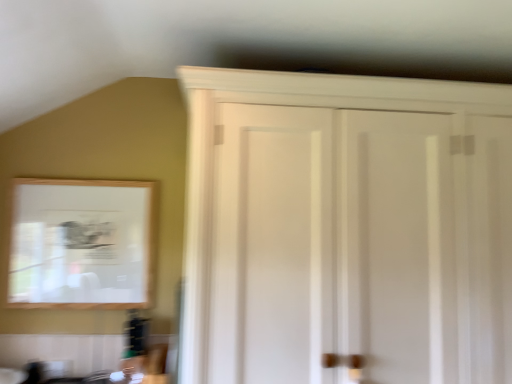
Question: Is wooden-framed mirror at upper left closer to camera compared to white wood cupboard at upper right?

Choices:
 (A) yes
 (B) no

Answer: (B)

Question: Does wooden-framed mirror at upper left have a smaller size compared to white wood cupboard at upper right?

Choices:
 (A) yes
 (B) no

Answer: (A)

Question: Is white wood cupboard at upper right a part of wooden-framed mirror at upper left?

Choices:
 (A) no
 (B) yes

Answer: (A)

Question: Is wooden-framed mirror at upper left at the right side of white wood cupboard at upper right?

Choices:
 (A) yes
 (B) no

Answer: (B)

Question: Is wooden-framed mirror at upper left facing away from white wood cupboard at upper right?

Choices:
 (A) yes
 (B) no

Answer: (B)

Question: Considering the relative sizes of wooden-framed mirror at upper left and white wood cupboard at upper right in the image provided, is wooden-framed mirror at upper left wider than white wood cupboard at upper right?

Choices:
 (A) no
 (B) yes

Answer: (A)

Question: From a real-world perspective, is white wood cupboard at upper right located higher than wooden-framed mirror at upper left?

Choices:
 (A) yes
 (B) no

Answer: (A)

Question: Does white wood cupboard at upper right have a greater width compared to wooden-framed mirror at upper left?

Choices:
 (A) no
 (B) yes

Answer: (B)

Question: Can you confirm if white wood cupboard at upper right is positioned to the left of wooden-framed mirror at upper left?

Choices:
 (A) yes
 (B) no

Answer: (B)

Question: Can you confirm if white wood cupboard at upper right is taller than wooden-framed mirror at upper left?

Choices:
 (A) yes
 (B) no

Answer: (A)

Question: Does white wood cupboard at upper right have a smaller size compared to wooden-framed mirror at upper left?

Choices:
 (A) yes
 (B) no

Answer: (B)

Question: Is white wood cupboard at upper right surrounding wooden-framed mirror at upper left?

Choices:
 (A) yes
 (B) no

Answer: (B)

Question: From the image's perspective, relative to white wood cupboard at upper right, is wooden-framed mirror at upper left above or below?

Choices:
 (A) below
 (B) above

Answer: (A)